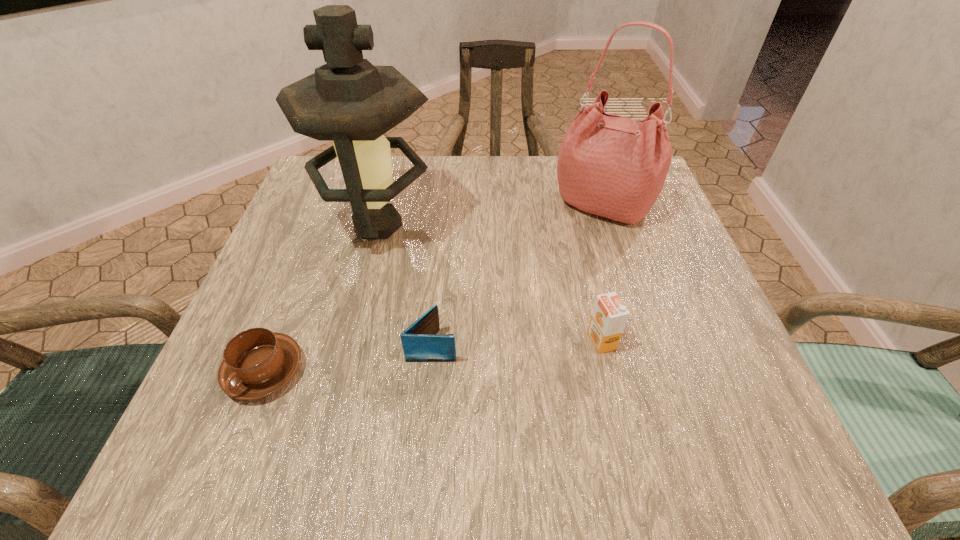
Where is `object that stands as the closest to the handbag`? This screenshot has width=960, height=540. object that stands as the closest to the handbag is located at coordinates (x=609, y=316).

Identify the location of vacant point that satisfies the following two spatial constraints: 1. on the exterior surface of the wallet; 2. on the side of the cappuccino with the handle. (430, 370).

At what (x,y) coordinates should I click in order to perform the action: click on free space in the image that satisfies the following two spatial constraints: 1. on the exterior surface of the wallet; 2. on the side of the cappuccino with the handle. Please return your answer as a coordinate pair (x, y). Image resolution: width=960 pixels, height=540 pixels. Looking at the image, I should click on (430, 370).

You are a GUI agent. You are given a task and a screenshot of the screen. Output one action in this format:
    pyautogui.click(x=<x>, y=<y>)
    Task: Click on the vacant point that satisfies the following two spatial constraints: 1. on the front side of the handbag; 2. on the exterior surface of the wallet
    Image resolution: width=960 pixels, height=540 pixels.
    Given the screenshot: What is the action you would take?
    pyautogui.click(x=648, y=345)